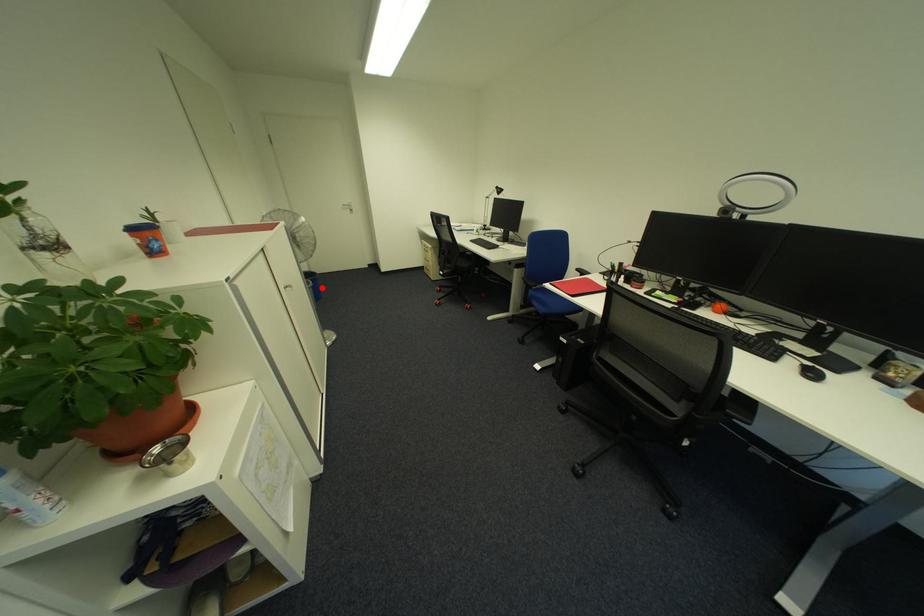
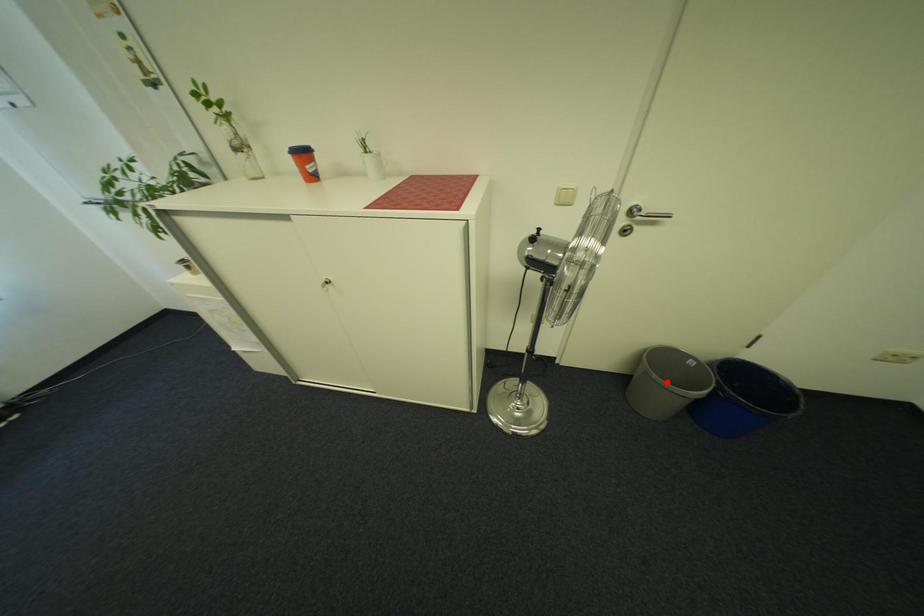
I am providing you with two images of the same scene from different viewpoints. A red point is marked on the first image and another point is marked on the second image. Is the marked point in image1 the same physical position as the marked point in image2?

No